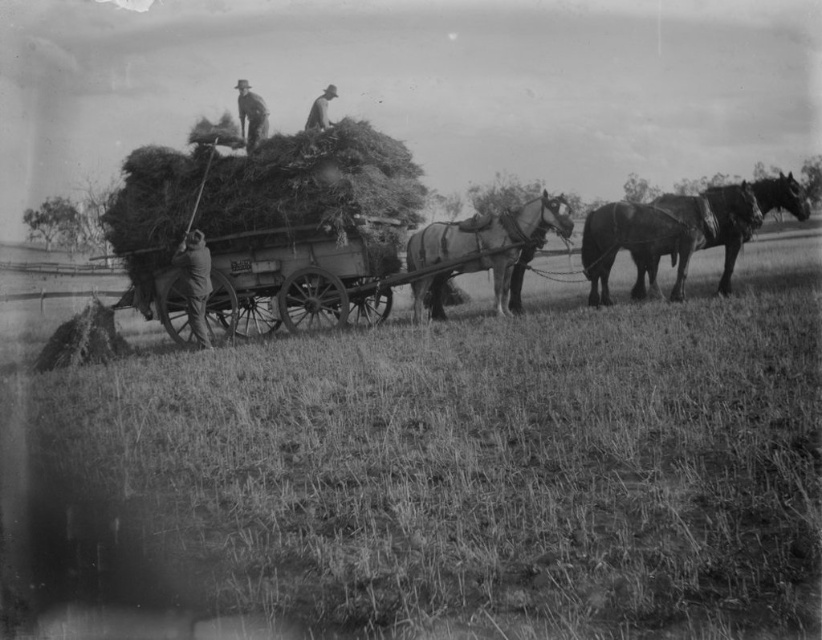
Question: Is the position of grassy field at lower left less distant than that of smooth brown horse at center?

Choices:
 (A) yes
 (B) no

Answer: (A)

Question: Can you confirm if smooth brown hat at upper center is thinner than light brown leather hat at upper center?

Choices:
 (A) yes
 (B) no

Answer: (B)

Question: Is smooth brown horse at center above light brown leather hat at upper center?

Choices:
 (A) no
 (B) yes

Answer: (A)

Question: Among these objects, which one is nearest to the camera?

Choices:
 (A) smooth brown horse at center
 (B) grassy field at lower left
 (C) dark brown fur at right

Answer: (B)

Question: Among these points, which one is farthest from the camera?

Choices:
 (A) (206, 273)
 (B) (455, 227)
 (C) (248, 124)
 (D) (501, 529)

Answer: (C)

Question: Which is nearer to the dark brown fur at right?

Choices:
 (A) light brown leather hat at upper center
 (B) smooth brown horse at center

Answer: (B)